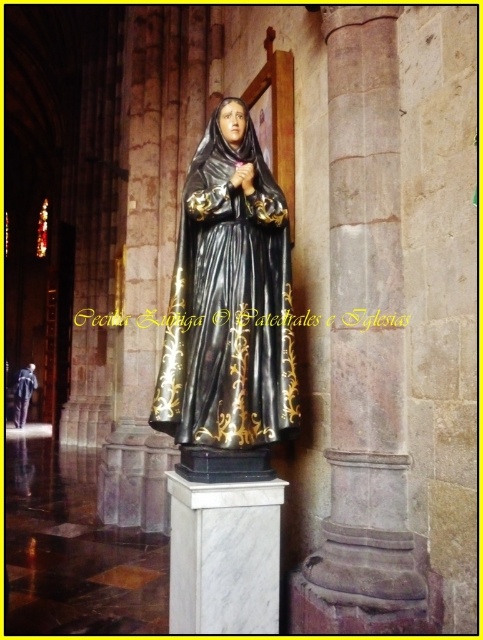
Question: From the image, what is the correct spatial relationship of black glossy statue at center in relation to white marble pedestal at center?

Choices:
 (A) above
 (B) below

Answer: (A)

Question: Does smooth stone column at center have a larger size compared to black glossy statue at center?

Choices:
 (A) yes
 (B) no

Answer: (A)

Question: Which object is closer to the camera taking this photo?

Choices:
 (A) white marble pedestal at center
 (B) black glossy robe at center
 (C) black glossy statue at center

Answer: (A)

Question: Does white marble pedestal at center appear under black glossy robe at center?

Choices:
 (A) yes
 (B) no

Answer: (B)

Question: Among these objects, which one is farthest from the camera?

Choices:
 (A) black glossy statue at center
 (B) white marble pedestal at center
 (C) black glossy robe at center

Answer: (C)

Question: Estimate the real-world distances between objects in this image. Which object is farther from the smooth stone column at center?

Choices:
 (A) black glossy statue at center
 (B) black glossy robe at center

Answer: (B)